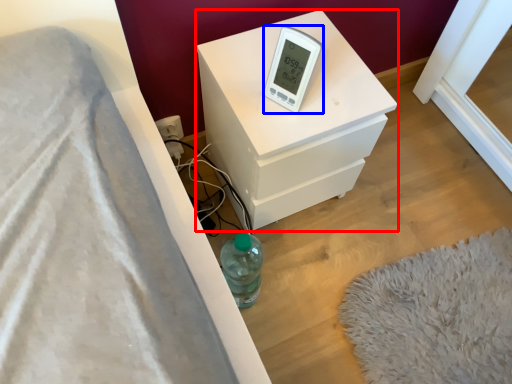
Question: Which point is closer to the camera, nightstand (highlighted by a red box) or thermometer (highlighted by a blue box)?

Choices:
 (A) nightstand
 (B) thermometer

Answer: (B)